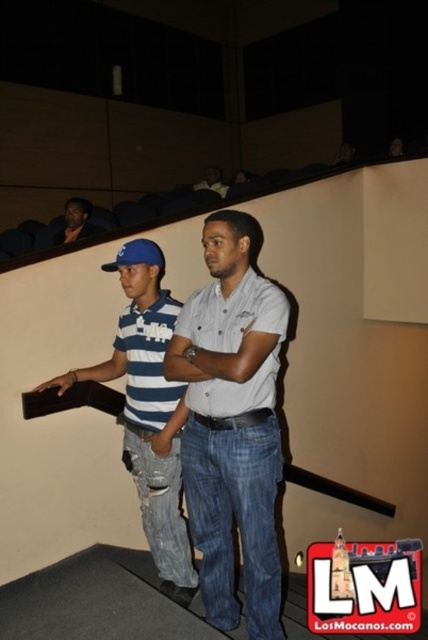
Question: Is light blue denim jeans at center wider than blue striped shirt at center?

Choices:
 (A) yes
 (B) no

Answer: (B)

Question: Is blue striped shirt at center below matte black jacket at upper left?

Choices:
 (A) no
 (B) yes

Answer: (B)

Question: Which of the following is the farthest from the observer?

Choices:
 (A) blue striped shirt at center
 (B) light blue denim jeans at center

Answer: (A)

Question: Which object is positioned closest to the light blue denim jeans at center?

Choices:
 (A) matte black shirt at upper center
 (B) matte black jacket at upper left

Answer: (B)

Question: From the image, what is the correct spatial relationship of blue striped shirt at center in relation to matte black jacket at upper left?

Choices:
 (A) left
 (B) right

Answer: (B)

Question: Which of the following is the closest to the observer?

Choices:
 (A) (219, 189)
 (B) (80, 212)
 (C) (125, 324)

Answer: (C)